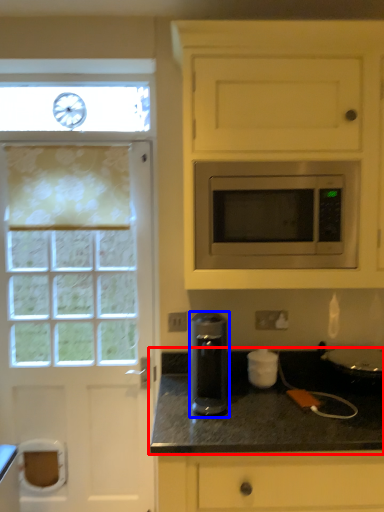
Question: Which point is further to the camera, countertop (highlighted by a red box) or kitchen appliance (highlighted by a blue box)?

Choices:
 (A) countertop
 (B) kitchen appliance

Answer: (B)